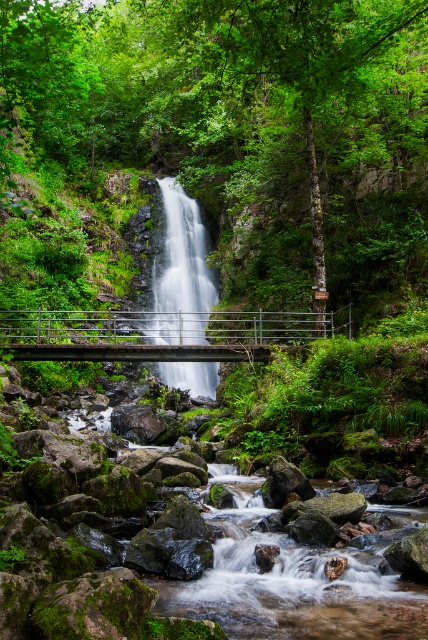
Looking at this image, between green leafy forest at center and translucent glass waterfall at center, which one is positioned higher?

Positioned higher is green leafy forest at center.

This screenshot has height=640, width=428. What do you see at coordinates (243, 128) in the screenshot?
I see `green leafy forest at center` at bounding box center [243, 128].

Is point (201, 188) closer to viewer compared to point (199, 304)?

No, (201, 188) is further to viewer.

What are the coordinates of `green leafy forest at center` in the screenshot? It's located at (243, 128).

Does green leafy forest at center appear over gray metallic bridge at center?

Yes.

Does green leafy forest at center have a greater height compared to gray metallic bridge at center?

Correct, green leafy forest at center is much taller as gray metallic bridge at center.

The height and width of the screenshot is (640, 428). Describe the element at coordinates (243, 128) in the screenshot. I see `green leafy forest at center` at that location.

Locate an element on the screen. The height and width of the screenshot is (640, 428). green leafy forest at center is located at coordinates (243, 128).

Can you confirm if gray metallic bridge at center is positioned to the right of translucent glass waterfall at center?

Yes, gray metallic bridge at center is to the right of translucent glass waterfall at center.

Which is above, gray metallic bridge at center or translucent glass waterfall at center?

translucent glass waterfall at center

Does point (275, 332) come in front of point (195, 316)?

No, it is not.

The image size is (428, 640). In order to click on gray metallic bridge at center in this screenshot , I will do `click(160, 333)`.